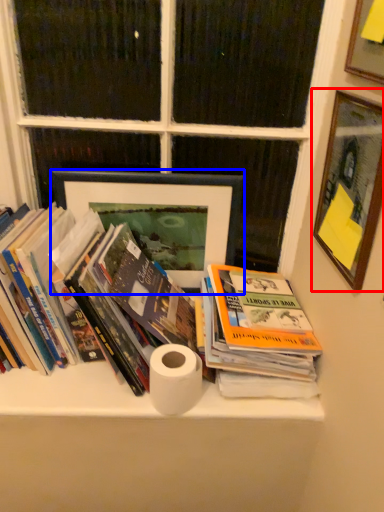
Question: Which point is closer to the camera, picture frame (highlighted by a red box) or picture frame (highlighted by a blue box)?

Choices:
 (A) picture frame
 (B) picture frame

Answer: (A)